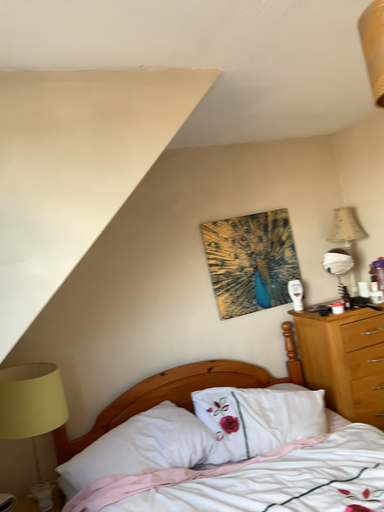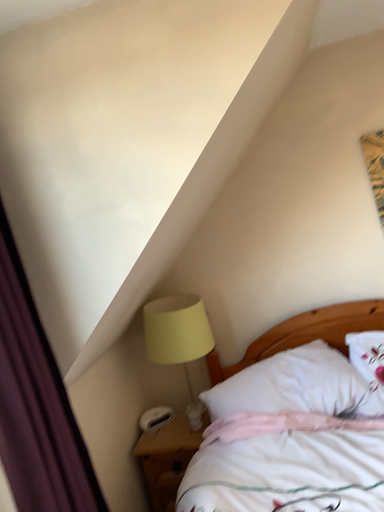
Question: Which way did the camera rotate in the video?

Choices:
 (A) rotated left
 (B) rotated right

Answer: (A)